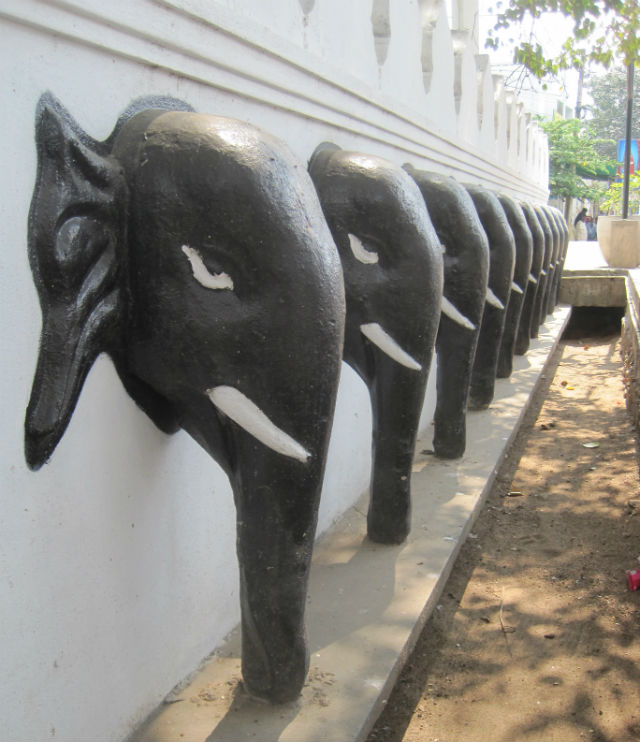
The width and height of the screenshot is (640, 742). Identify the location of wall. (144, 531).